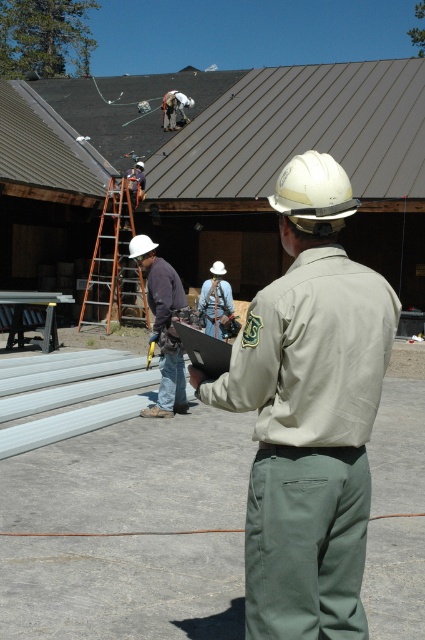
Question: Based on their relative distances, which object is farther from the wooden at left?

Choices:
 (A) khaki uniform at center
 (B) brushed metal tool at center

Answer: (A)

Question: Is khaki uniform at center positioned before wooden at left?

Choices:
 (A) yes
 (B) no

Answer: (A)

Question: Where is khaki uniform at center located in relation to wooden at left in the image?

Choices:
 (A) left
 (B) right

Answer: (B)

Question: Among these points, which one is farthest from the camera?

Choices:
 (A) (96, 260)
 (B) (107, 102)
 (C) (221, 298)
 (D) (348, 456)

Answer: (B)

Question: Is khaki uniform at center positioned at the back of wooden at left?

Choices:
 (A) no
 (B) yes

Answer: (A)

Question: Which point appears farthest from the camera in this image?

Choices:
 (A) (201, 314)
 (B) (124, 268)

Answer: (B)